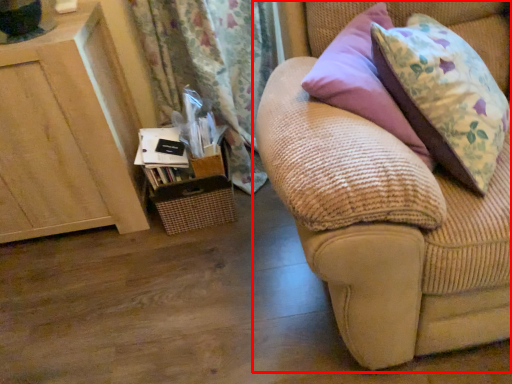
Question: Observing the image, what is the correct spatial positioning of studio couch (annotated by the red box) in reference to furniture?

Choices:
 (A) left
 (B) right

Answer: (B)